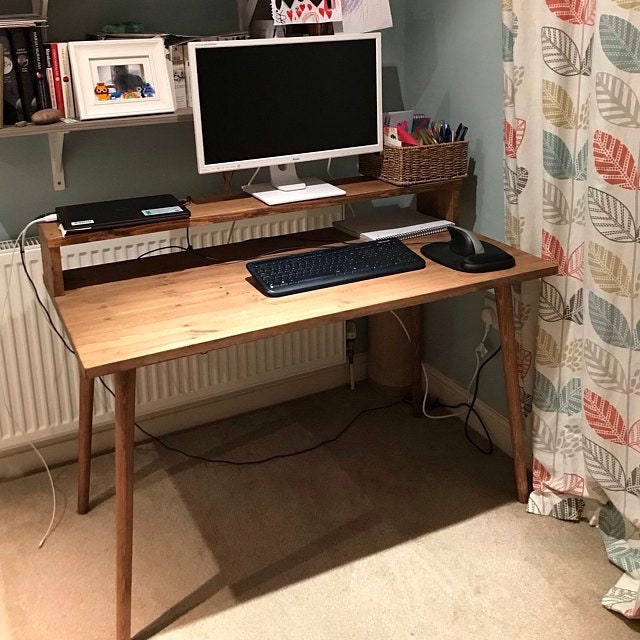
Where is `floor`? floor is located at coordinates (189, 618).